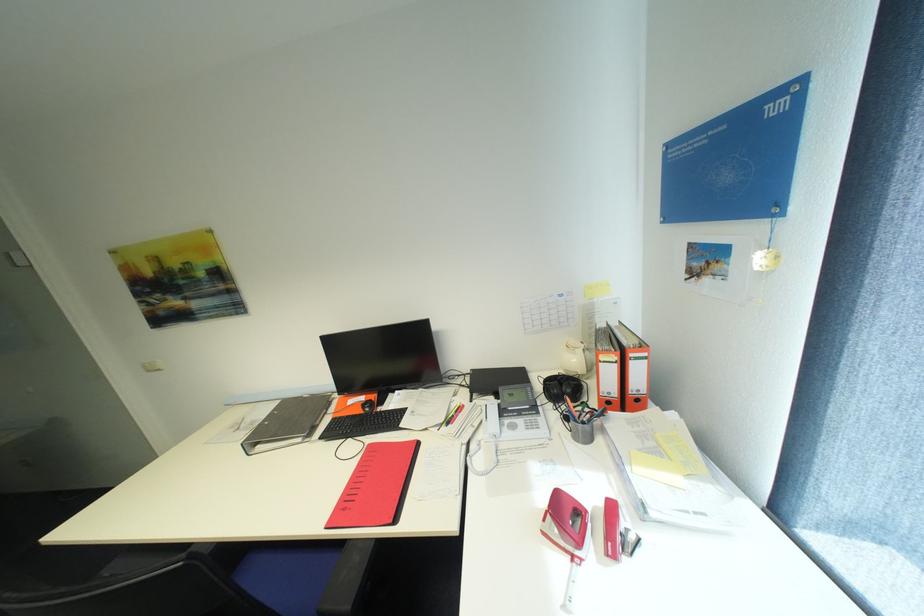
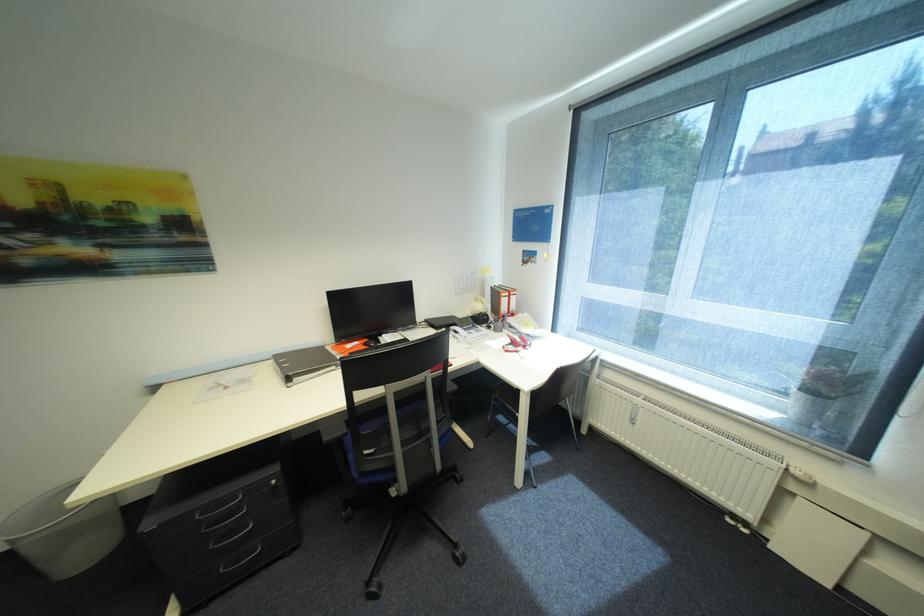
The point at (575, 419) is marked in the first image. Where is the corresponding point in the second image?

(496, 328)